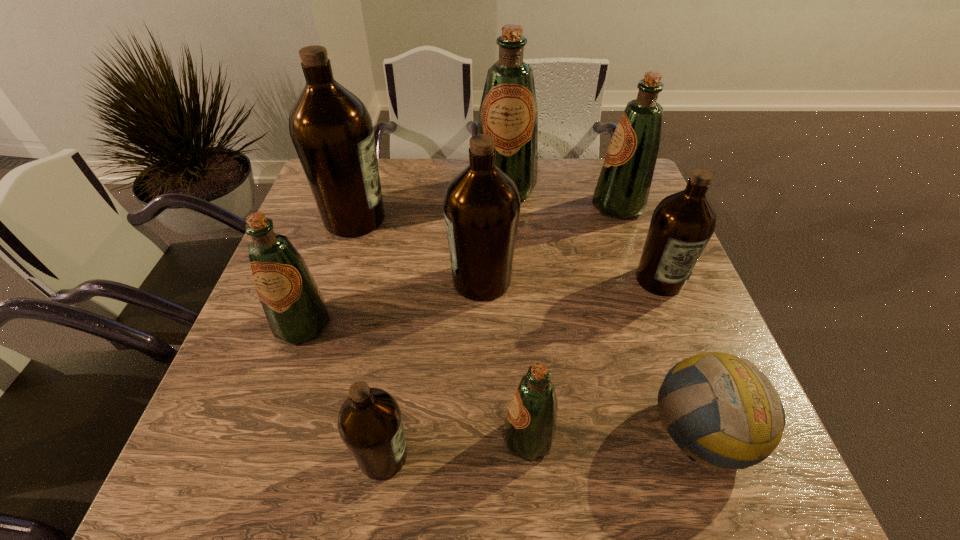
Where is `the smallest brown olive oil`? The height and width of the screenshot is (540, 960). the smallest brown olive oil is located at coordinates pos(370,424).

Identify the location of volleyball. The image size is (960, 540). (742, 419).

Find the location of a particular element. free location located 0.130m on the front-facing side of the biggest green olive oil is located at coordinates (508, 238).

The height and width of the screenshot is (540, 960). I want to click on vacant space situated 0.150m on the label of the biggest brown olive oil, so click(x=443, y=219).

Identify the location of blank space located 0.300m on the front-facing side of the rightmost green olive oil. Image resolution: width=960 pixels, height=540 pixels. (488, 206).

Identify the location of vacant region located 0.110m on the front-facing side of the rightmost green olive oil. (553, 206).

Find the location of a particular element. free space located 0.170m on the front-facing side of the rightmost green olive oil is located at coordinates (533, 206).

At what (x,y) coordinates should I click in order to perform the action: click on free location located on the label of the second brown olive oil from right to left. Please return your answer as a coordinate pair (x, y). The width and height of the screenshot is (960, 540). Looking at the image, I should click on (297, 280).

Locate an element on the screen. Image resolution: width=960 pixels, height=540 pixels. free space located 0.290m on the label of the second brown olive oil from right to left is located at coordinates (329, 280).

The height and width of the screenshot is (540, 960). What are the coordinates of `vacant region located 0.360m on the label of the second brown olive oil from right to left` in the screenshot? It's located at tap(300, 280).